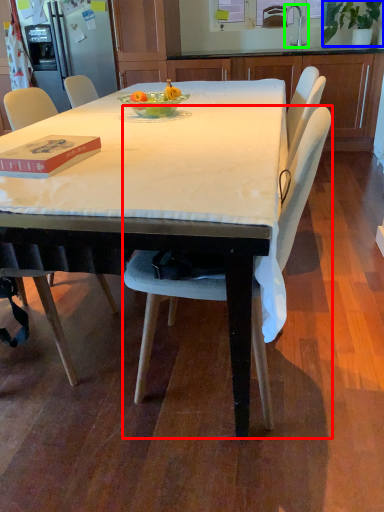
Question: Which object is the closest to the chair (highlighted by a red box)? Choose among these: houseplant (highlighted by a blue box) or faucet (highlighted by a green box).

Choices:
 (A) houseplant
 (B) faucet

Answer: (A)